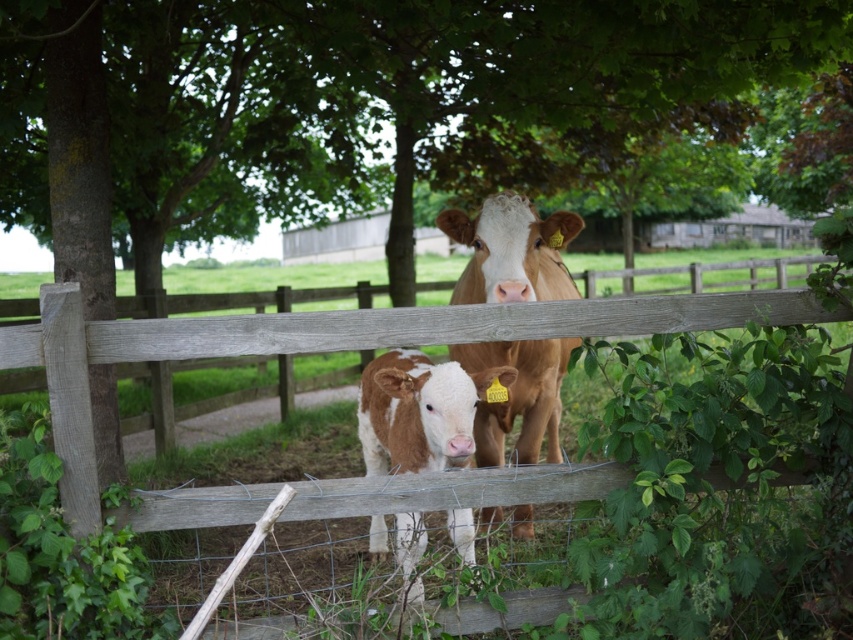
You are a farmer trying to determine if there is enough space between the weathered wood fence at center and the brown speckled calf at center to fit a 30 inch wide feeding trough. Can you confirm if the space is sufficient?

The distance between the weathered wood fence at center and the brown speckled calf at center is 31.91 inches, which is wider than the 30 inch feeding trough. Therefore, the space is sufficient to place the trough between them.

You are a photographer standing in front of the fence. You want to place a sticker on the point that is closer to you. Which point should you choose between point (491, 438) and point (474, 381)?

Point (474, 381) is closer to you than point (491, 438), so you should choose point (474, 381) to place the sticker.

You are a photographer trying to capture both the weathered wood fence at center and the brown smooth cow at center in a single shot. Based on their positions, which object should you adjust your camera angle to focus on first to ensure both are in frame?

The weathered wood fence at center is positioned on the left side of the brown smooth cow at center. To capture both in a single shot, you should first focus on the brown smooth cow at center and then adjust your angle to include the fence on its left side.